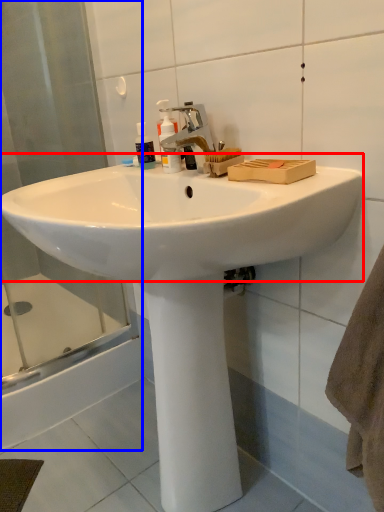
Question: Which point is further to the camera, sink (highlighted by a red box) or shower door (highlighted by a blue box)?

Choices:
 (A) sink
 (B) shower door

Answer: (B)